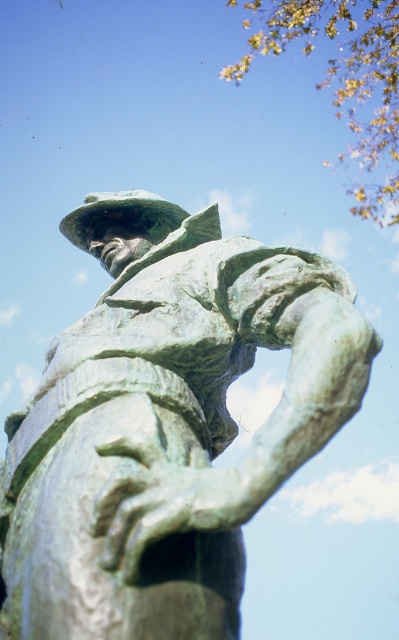
Can you confirm if green patina statue at center is positioned above green patina hat at center?

Incorrect, green patina statue at center is not positioned above green patina hat at center.

Can you confirm if green patina statue at center is taller than green patina hat at center?

Correct, green patina statue at center is much taller as green patina hat at center.

This screenshot has height=640, width=399. What do you see at coordinates (165, 424) in the screenshot?
I see `green patina statue at center` at bounding box center [165, 424].

What are the coordinates of `green patina statue at center` in the screenshot? It's located at (165, 424).